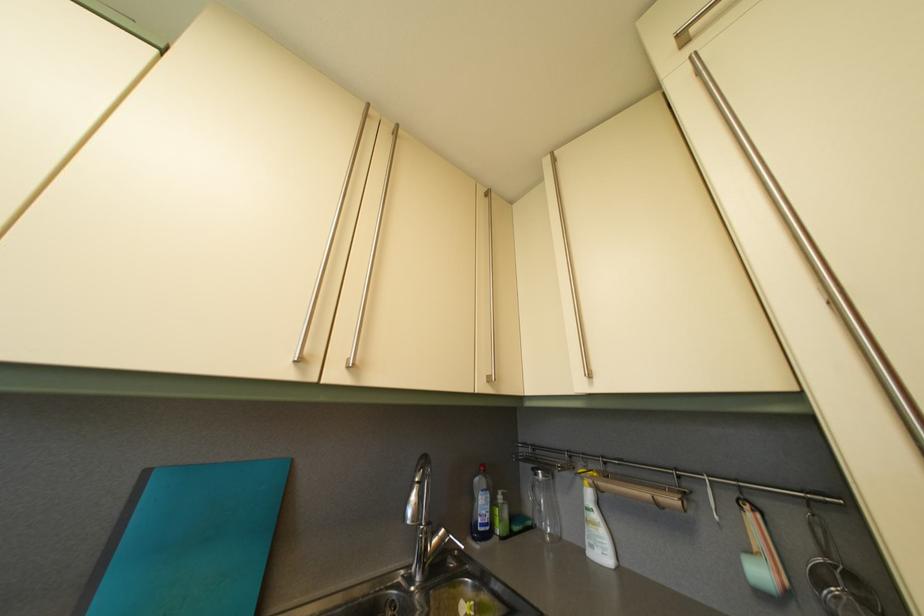
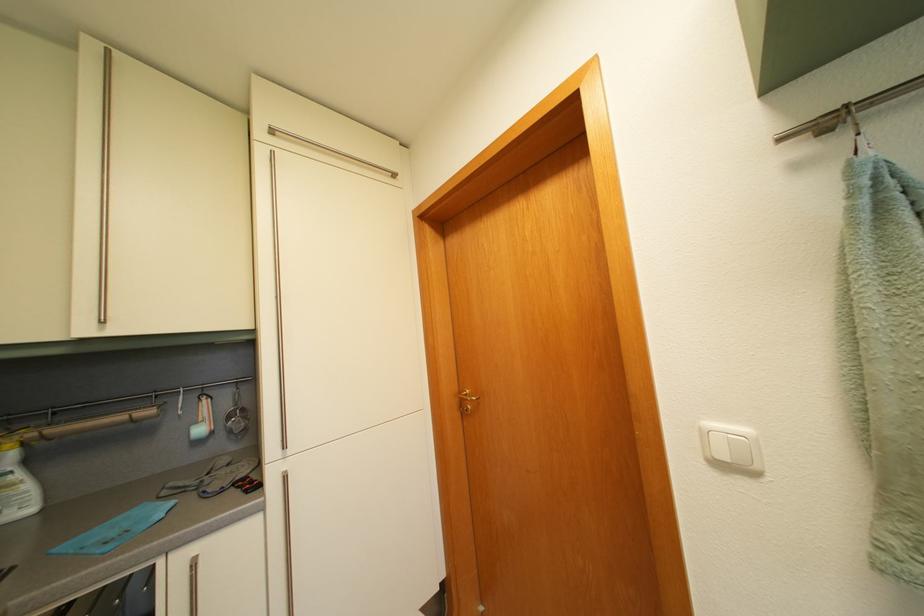
Where in the second image is the point corresponding to point (603, 524) from the first image?

(26, 484)